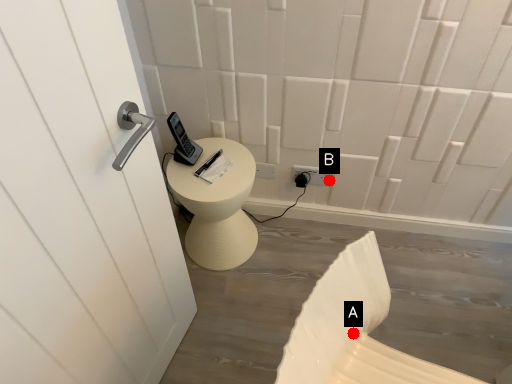
Question: Two points are circled on the image, labeled by A and B beside each circle. Which point appears closest to the camera in this image?

Choices:
 (A) A is closer
 (B) B is closer

Answer: (A)